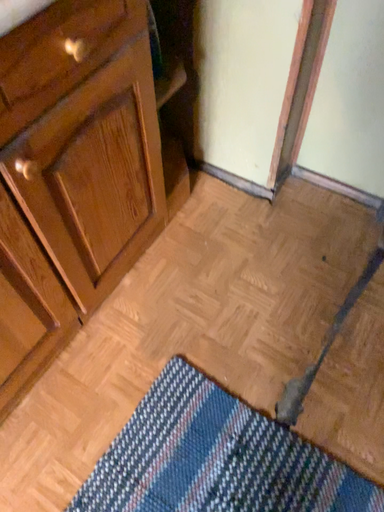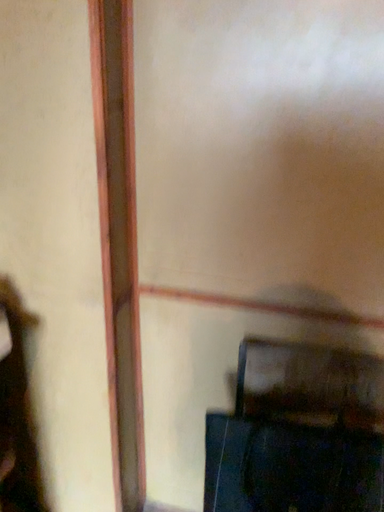
Question: Which way did the camera rotate in the video?

Choices:
 (A) rotated left
 (B) rotated right

Answer: (B)